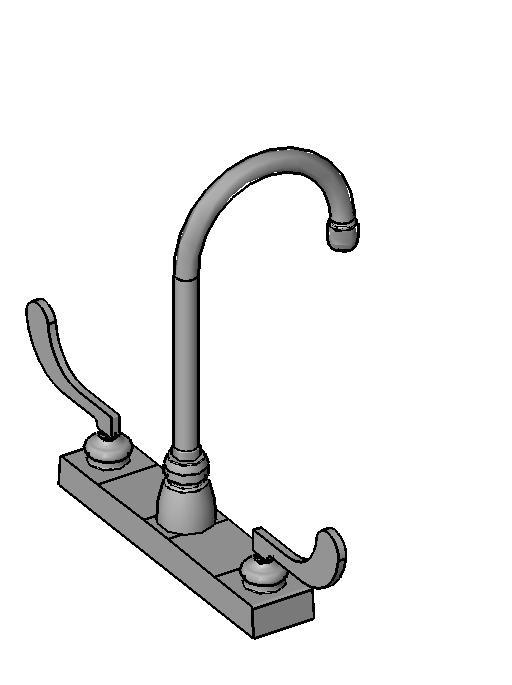
The width and height of the screenshot is (512, 685). I want to click on 2 grey knobs, so (x=330, y=560), (x=44, y=342).